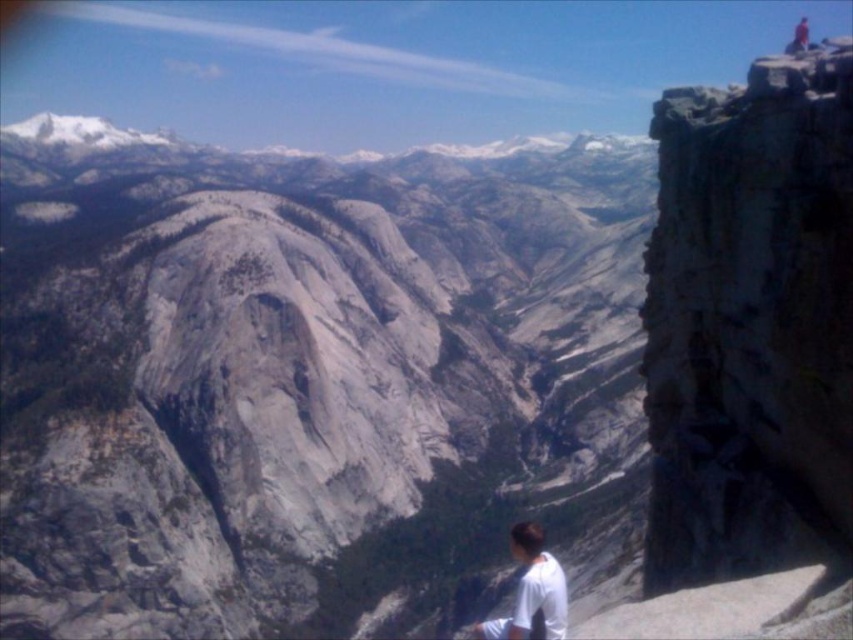
Question: Which object appears closest to the camera in this image?

Choices:
 (A) gray rock formation at center
 (B) white matte shirt at lower right

Answer: (B)

Question: Does gray rock formation at center lie behind white matte shirt at lower right?

Choices:
 (A) no
 (B) yes

Answer: (B)

Question: Which of the following is the farthest from the observer?

Choices:
 (A) gray rock formation at center
 (B) white matte shirt at lower right

Answer: (A)

Question: Among these objects, which one is nearest to the camera?

Choices:
 (A) white matte shirt at lower right
 (B) gray rock formation at center

Answer: (A)

Question: Is gray rock formation at center thinner than white matte shirt at lower right?

Choices:
 (A) no
 (B) yes

Answer: (A)

Question: Does gray rock formation at center come behind white matte shirt at lower right?

Choices:
 (A) yes
 (B) no

Answer: (A)